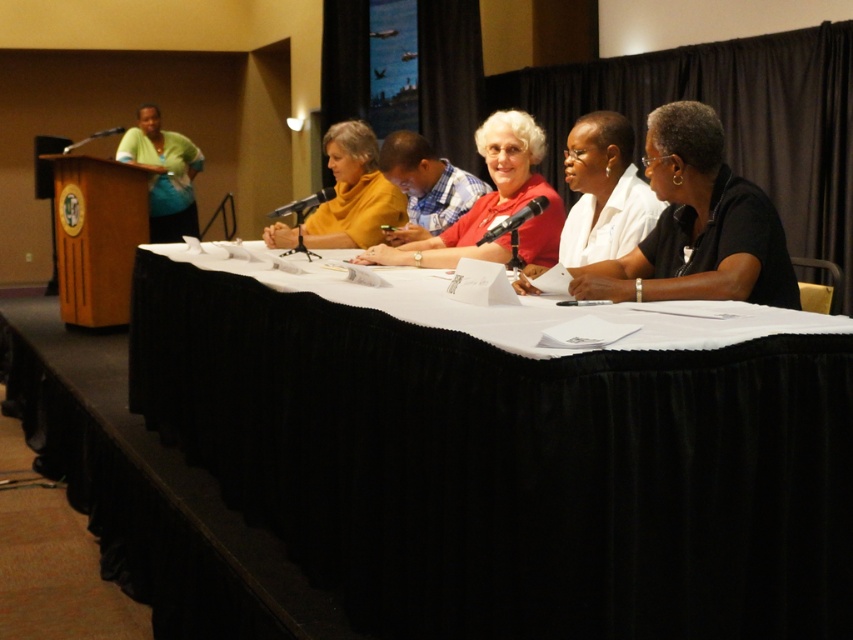
Question: Is matte yellow sweater at center above plaid shirt at center?

Choices:
 (A) no
 (B) yes

Answer: (B)

Question: Among these points, which one is nearest to the camera?

Choices:
 (A) (712, 112)
 (B) (532, 148)
 (C) (611, 176)
 (D) (430, 163)

Answer: (A)

Question: Based on their relative distances, which object is farther from the white matte shirt at center?

Choices:
 (A) matte green blouse at left
 (B) matte yellow sweater at center
 (C) white fabric table at center
 (D) matte red shirt at center

Answer: (A)

Question: Is matte red shirt at center below matte green blouse at left?

Choices:
 (A) yes
 (B) no

Answer: (A)

Question: Is black matte shirt at right wider than white matte shirt at center?

Choices:
 (A) no
 (B) yes

Answer: (B)

Question: Which object is the farthest from the white fabric table at center?

Choices:
 (A) matte green blouse at left
 (B) matte red shirt at center
 (C) matte yellow sweater at center
 (D) black matte shirt at right

Answer: (A)